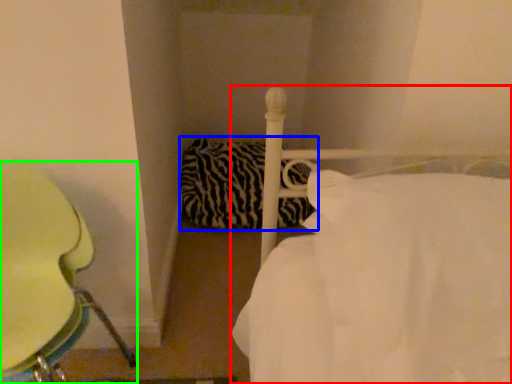
Question: Considering the real-world distances, which object is closest to bed (highlighted by a red box)? pillow (highlighted by a blue box) or furniture (highlighted by a green box).

Choices:
 (A) pillow
 (B) furniture

Answer: (B)